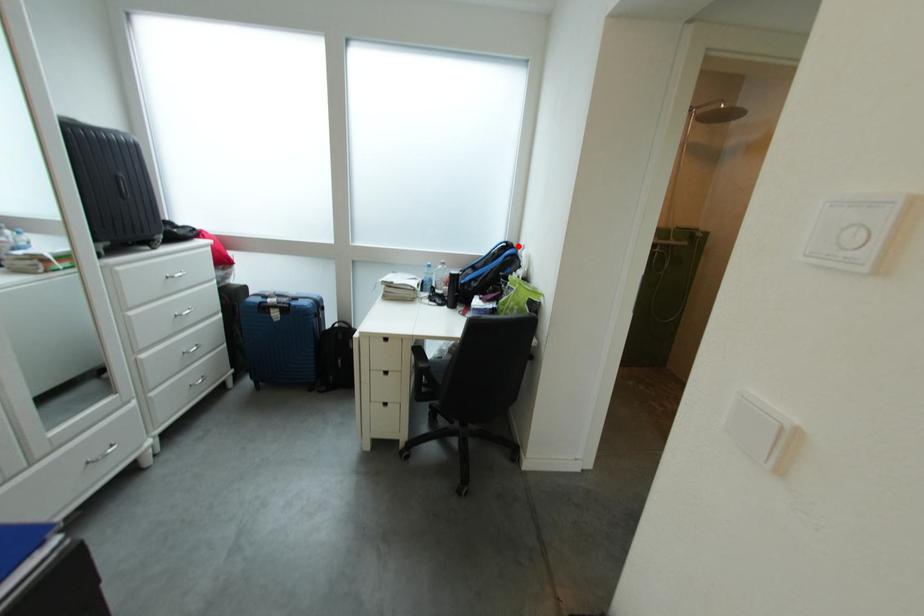
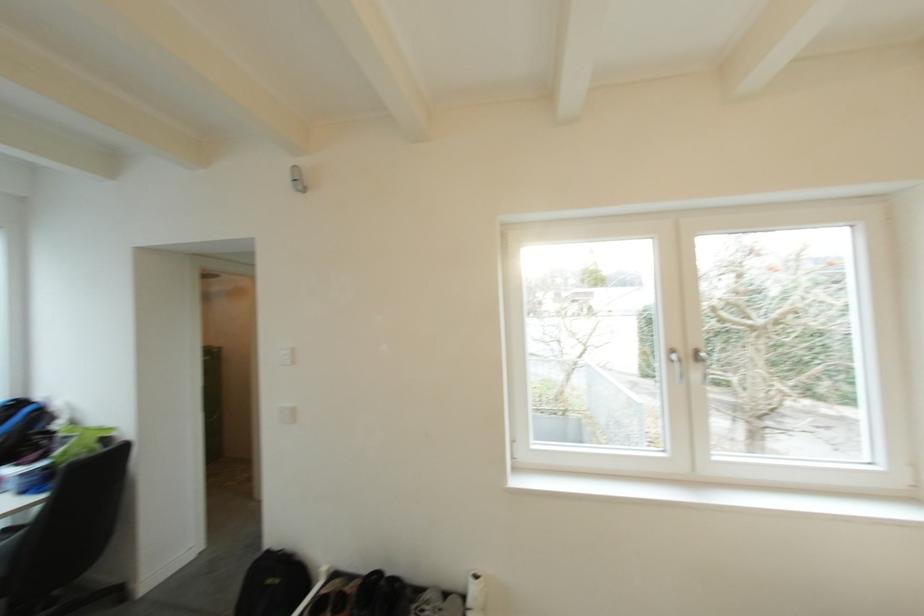
Question: I am providing you with two images of the same scene from different viewpoints. In image1, a red point is highlighted. Considering the same 3D point in image2, which of the following is correct?

Choices:
 (A) It is closer
 (B) It is farther

Answer: (A)